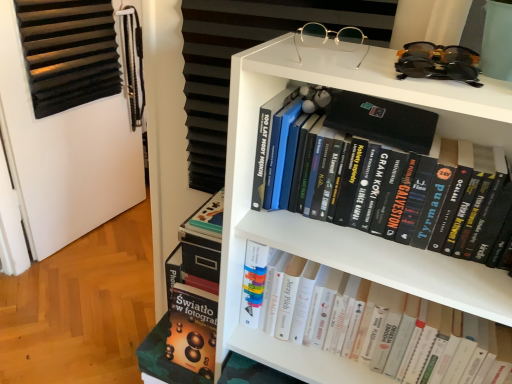
Question: Is black matte book at upper center, the first book positioned from the top, further to the viewer compared to white matte bookcase at upper center?

Choices:
 (A) yes
 (B) no

Answer: (B)

Question: Considering the relative positions of black matte book at upper center, the first book positioned from the top, and white matte bookcase at upper center in the image provided, is black matte book at upper center, the first book positioned from the top, to the left of white matte bookcase at upper center from the viewer's perspective?

Choices:
 (A) no
 (B) yes

Answer: (A)

Question: Is black matte book at upper center, the 2th book from the bottom, at the right side of white matte bookcase at upper center?

Choices:
 (A) no
 (B) yes

Answer: (B)

Question: Is black matte book at upper center, the 2th book from the bottom, wider than white matte bookcase at upper center?

Choices:
 (A) yes
 (B) no

Answer: (A)

Question: Is black matte book at upper center, the 2th book from the bottom, smaller than white matte bookcase at upper center?

Choices:
 (A) no
 (B) yes

Answer: (B)

Question: From the image's perspective, does black matte book at upper center, the 2th book from the bottom, appear higher than white matte bookcase at upper center?

Choices:
 (A) yes
 (B) no

Answer: (A)

Question: From a real-world perspective, is black matte book at upper center, the 2th book from the bottom, on top of hardcover books at center, which is the first book from bottom to top?

Choices:
 (A) no
 (B) yes

Answer: (B)

Question: From the image's perspective, is black matte book at upper center, the first book positioned from the top, on top of hardcover books at center, which is the first book from bottom to top?

Choices:
 (A) no
 (B) yes

Answer: (B)

Question: Does black matte book at upper center, the 2th book from the bottom, have a greater width compared to hardcover books at center, which is the 2th book from top to bottom?

Choices:
 (A) no
 (B) yes

Answer: (A)

Question: From the image's perspective, is black matte book at upper center, the 2th book from the bottom, located beneath hardcover books at center, which is the first book from bottom to top?

Choices:
 (A) no
 (B) yes

Answer: (A)

Question: Is black matte book at upper center, the first book positioned from the top, not within hardcover books at center, which is the first book from bottom to top?

Choices:
 (A) yes
 (B) no

Answer: (A)

Question: Is black matte book at upper center, the 2th book from the bottom, smaller than hardcover books at center, which is the first book from bottom to top?

Choices:
 (A) yes
 (B) no

Answer: (A)

Question: Is black plastic sunglasses at upper right, marked as the 1th glasses in a right-to-left arrangement, smaller than gold metallic glasses at upper center, the 2th glasses viewed from the right?

Choices:
 (A) no
 (B) yes

Answer: (A)